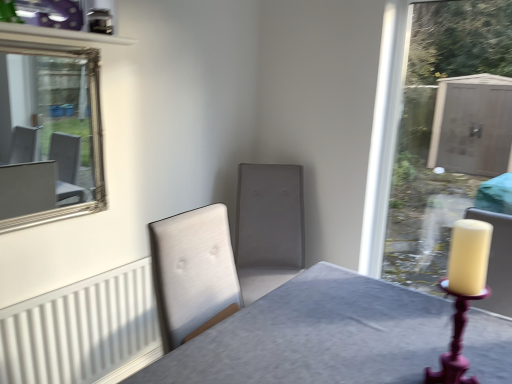
Question: Considering the relative positions of matte gray swivel chair at center and silver/glass mirror at upper left in the image provided, is matte gray swivel chair at center in front of silver/glass mirror at upper left?

Choices:
 (A) no
 (B) yes

Answer: (A)

Question: Is matte gray swivel chair at center bigger than silver/glass mirror at upper left?

Choices:
 (A) no
 (B) yes

Answer: (B)

Question: From a real-world perspective, is matte gray swivel chair at center over silver/glass mirror at upper left?

Choices:
 (A) yes
 (B) no

Answer: (B)

Question: Does matte gray swivel chair at center appear on the left side of silver/glass mirror at upper left?

Choices:
 (A) yes
 (B) no

Answer: (B)

Question: Considering the relative sizes of matte gray swivel chair at center and silver/glass mirror at upper left in the image provided, is matte gray swivel chair at center wider than silver/glass mirror at upper left?

Choices:
 (A) yes
 (B) no

Answer: (A)

Question: In terms of height, does matte gray swivel chair at center look taller or shorter compared to matte purple candle holder at right?

Choices:
 (A) short
 (B) tall

Answer: (B)

Question: Considering the relative positions of matte gray swivel chair at center and matte purple candle holder at right in the image provided, is matte gray swivel chair at center to the left or to the right of matte purple candle holder at right?

Choices:
 (A) right
 (B) left

Answer: (B)

Question: Do you think matte gray swivel chair at center is within matte purple candle holder at right, or outside of it?

Choices:
 (A) inside
 (B) outside

Answer: (B)

Question: In terms of width, does matte gray swivel chair at center look wider or thinner when compared to matte purple candle holder at right?

Choices:
 (A) wide
 (B) thin

Answer: (A)

Question: Does point 450,374 appear closer or farther from the camera than point 252,233?

Choices:
 (A) closer
 (B) farther

Answer: (A)

Question: Is matte purple candle holder at right situated inside matte gray swivel chair at center or outside?

Choices:
 (A) inside
 (B) outside

Answer: (B)

Question: Is matte purple candle holder at right in front of or behind matte gray swivel chair at center in the image?

Choices:
 (A) front
 (B) behind

Answer: (A)

Question: Looking at their shapes, would you say matte purple candle holder at right is wider or thinner than matte gray swivel chair at center?

Choices:
 (A) wide
 (B) thin

Answer: (B)

Question: Considering the positions of white ribbed radiator at lower left and matte purple candle holder at right in the image, is white ribbed radiator at lower left bigger or smaller than matte purple candle holder at right?

Choices:
 (A) small
 (B) big

Answer: (B)

Question: Is white ribbed radiator at lower left taller or shorter than matte purple candle holder at right?

Choices:
 (A) short
 (B) tall

Answer: (B)